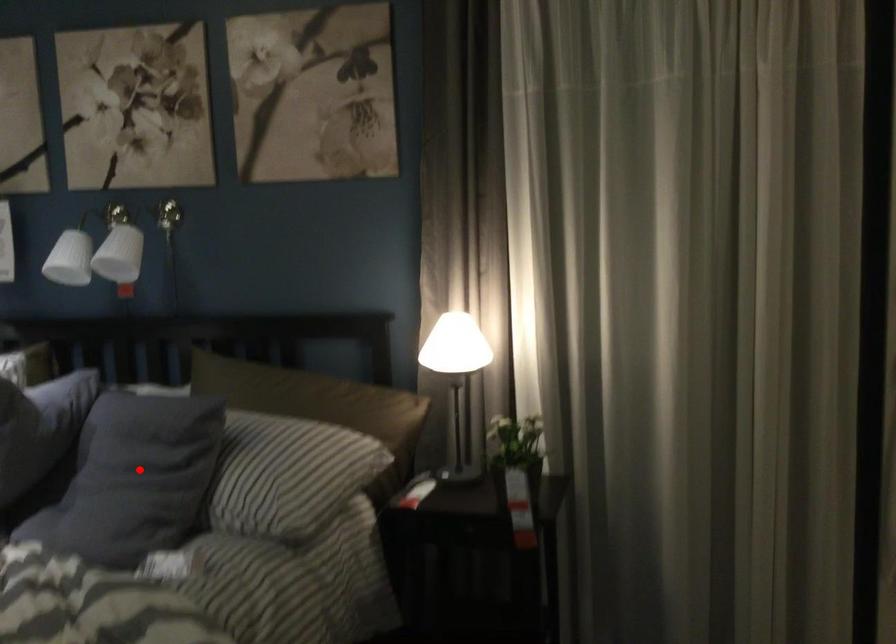
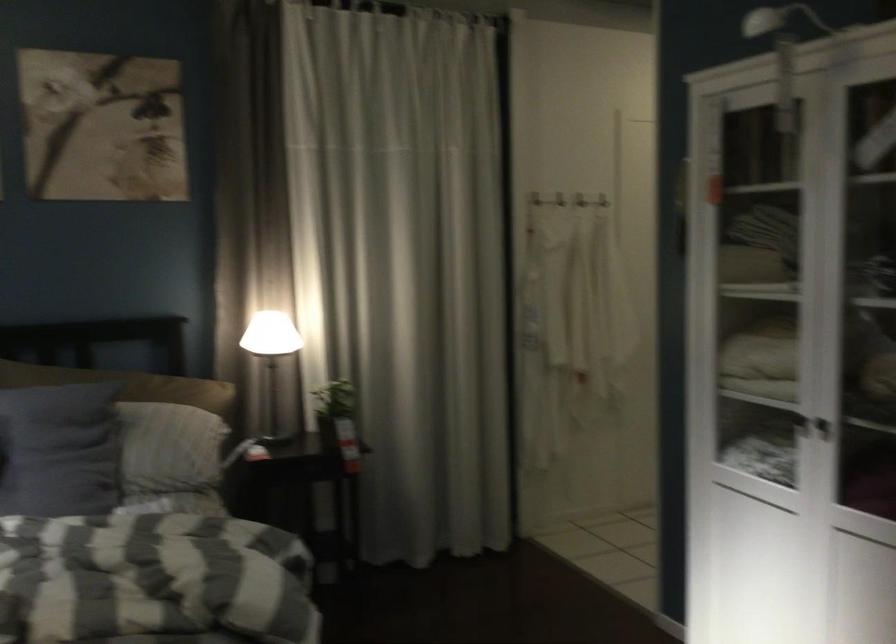
Question: A red point is marked in image1. In image2, is the corresponding 3D point closer to the camera or farther? Reply with the corresponding letter.

Choices:
 (A) The corresponding 3D point is closer.
 (B) The corresponding 3D point is farther.

Answer: (B)